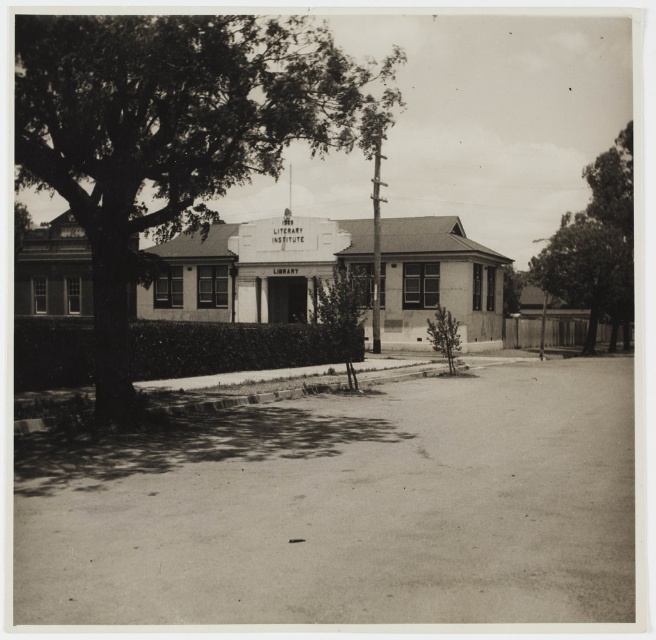
Question: Which point appears closest to the camera in this image?

Choices:
 (A) (169, 180)
 (B) (623, 230)

Answer: (A)

Question: Does green leafy tree at upper left have a lesser width compared to dark green leafy tree at right?

Choices:
 (A) yes
 (B) no

Answer: (A)

Question: Is green leafy tree at upper left below dark green leafy tree at right?

Choices:
 (A) yes
 (B) no

Answer: (B)

Question: Can you confirm if green leafy tree at upper left is smaller than dark green leafy tree at right?

Choices:
 (A) yes
 (B) no

Answer: (B)